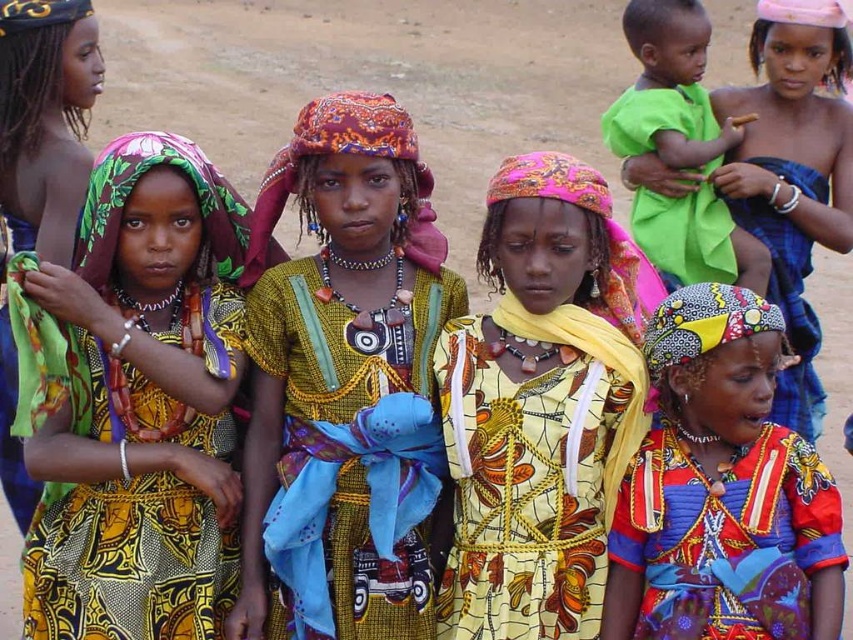
You are a photographer trying to capture a photo of the children. You notice two points in the scene marked as point 1 and point 2. If point 1 is at coordinate [151,188] and point 2 is at [16,74], which point is closer to the camera?

Point 1 at coordinate [151,188] is closer to the camera because it is in front of point 2 at [16,74].

You are a fashion designer observing the children in the scene. You want to create a new outfit using the same fabric type as the printed fabric dress at left and the yellow printed dress at center. Which dress has a fabric that is thinner and more suitable for warmer weather?

The printed fabric dress at left has a thinner fabric compared to the yellow printed dress at center, making it more suitable for warmer weather.

You are a photographer trying to capture the children in the scene. You notice the printed fabric dress at left and the yellow printed dress at center. Which dress is positioned lower in the image?

The printed fabric dress at left is located below the yellow printed dress at center, so it is positioned lower in the image.